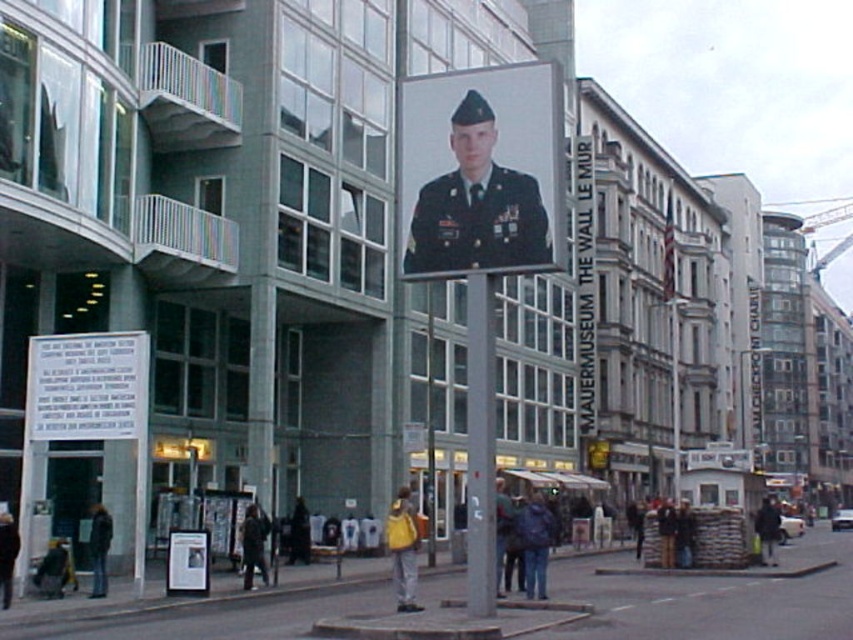
Can you confirm if metallic gray pole at center is bigger than matte black jacket at lower right?

Yes.

In the scene shown: Who is more distant from viewer, (492, 512) or (767, 536)?

Positioned behind is point (767, 536).

The height and width of the screenshot is (640, 853). I want to click on metallic gray pole at center, so click(x=480, y=444).

Between yellow fabric bag at lower center and matte black poster at center, which one has less height?

Standing shorter between the two is matte black poster at center.

Can you confirm if yellow fabric bag at lower center is wider than matte black poster at center?

Yes.

Who is more forward, (405, 529) or (177, 560)?

Point (405, 529)

Find the location of a particular element. yellow fabric bag at lower center is located at coordinates (403, 548).

Can you confirm if yellow fabric bag at lower center is bigger than matte black jacket at lower right?

Yes, yellow fabric bag at lower center is bigger than matte black jacket at lower right.

Who is more forward, (x=396, y=589) or (x=764, y=531)?

Point (x=396, y=589) is more forward.

Does point (416, 545) come in front of point (753, 529)?

Yes, point (416, 545) is closer to viewer.

Where is `yellow fabric bag at lower center`? This screenshot has height=640, width=853. yellow fabric bag at lower center is located at coordinates (403, 548).